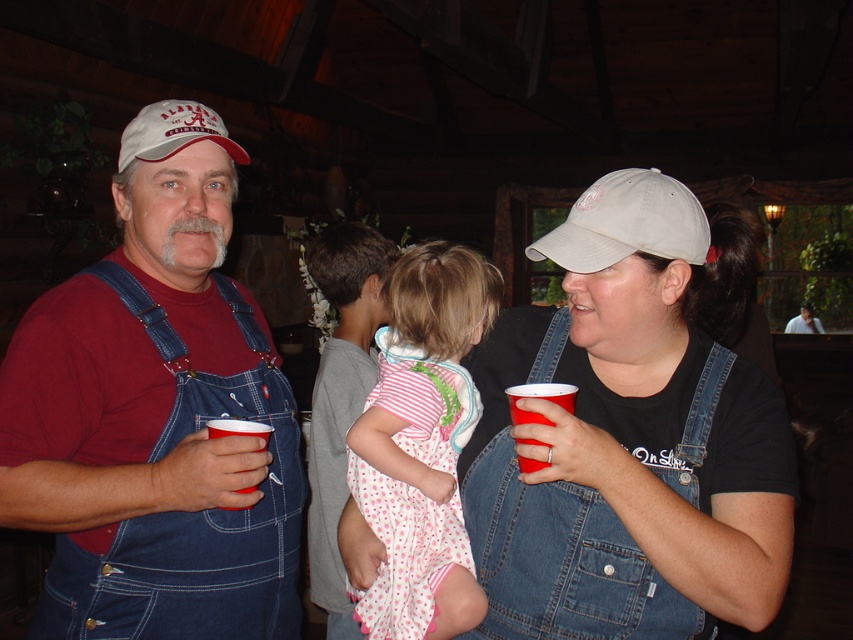
Question: Which of the following is the closest to the observer?

Choices:
 (A) (160, 131)
 (B) (169, 387)

Answer: (B)

Question: Is denim overalls at center smaller than red plastic cup at lower left?

Choices:
 (A) yes
 (B) no

Answer: (B)

Question: Which point is farther to the camera?

Choices:
 (A) polka dot fabric dress at center
 (B) red plastic cup at lower left
 (C) matte denim overalls at left

Answer: (A)

Question: Observing the image, what is the correct spatial positioning of denim overalls at center in reference to red plastic cup at lower left?

Choices:
 (A) above
 (B) below

Answer: (A)

Question: Which is farther from the polka dot fabric dress at center?

Choices:
 (A) matte fabric baseball cap at upper left
 (B) denim overalls at center
 (C) red plastic cup at lower left

Answer: (A)

Question: Does matte denim overalls at left have a greater width compared to polka dot fabric dress at center?

Choices:
 (A) yes
 (B) no

Answer: (A)